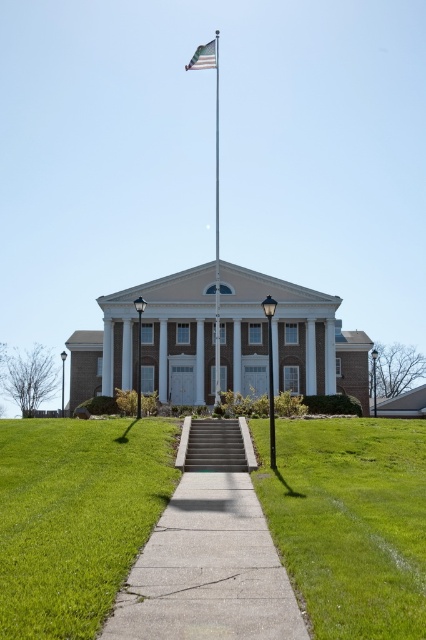
Question: Can you confirm if concrete at center is smaller than american flag at upper center?

Choices:
 (A) no
 (B) yes

Answer: (B)

Question: Which point is closer to the camera taking this photo?

Choices:
 (A) (199, 433)
 (B) (247, 497)
 (C) (204, 54)

Answer: (B)

Question: Which object appears closest to the camera in this image?

Choices:
 (A) american flag at upper center
 (B) green concrete stairs at center

Answer: (B)

Question: Observing the image, what is the correct spatial positioning of concrete at center in reference to green concrete stairs at center?

Choices:
 (A) above
 (B) below

Answer: (A)

Question: Considering the real-world distances, which object is farthest from the green concrete stairs at center?

Choices:
 (A) american flag at upper center
 (B) concrete at center

Answer: (A)

Question: Is green concrete stairs at center further to camera compared to american flag at upper center?

Choices:
 (A) yes
 (B) no

Answer: (B)